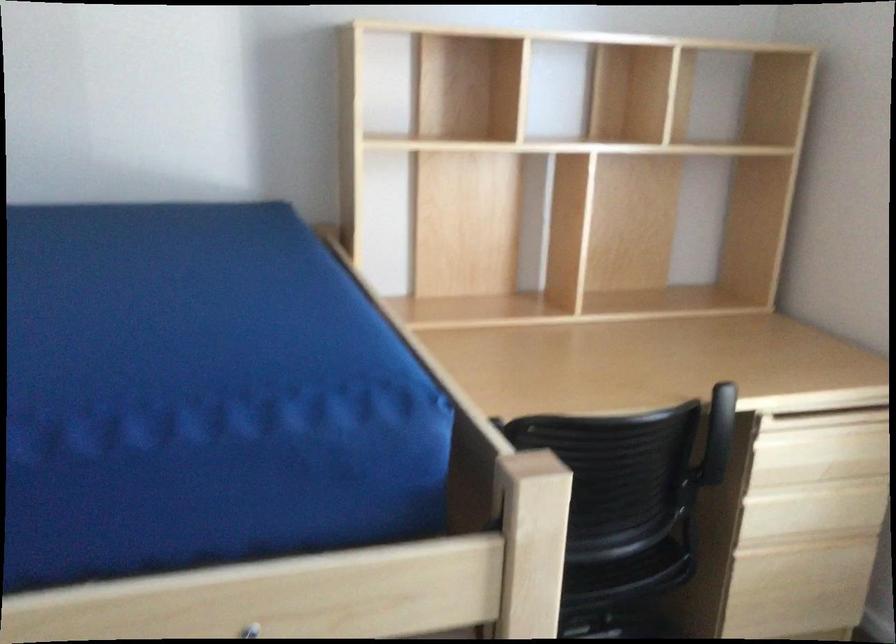
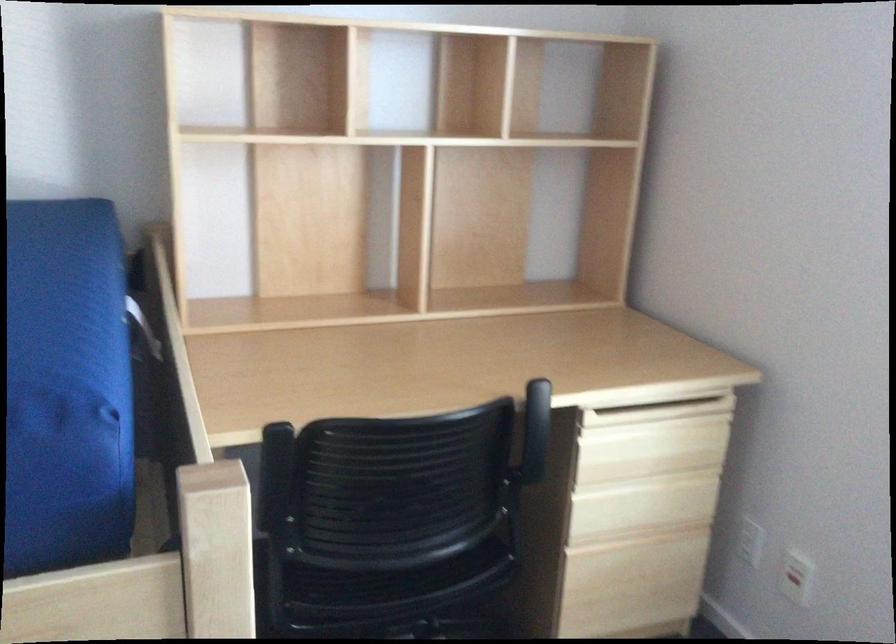
Question: I am providing you with two images of the same scene from different viewpoints. After the viewpoint changes to image2, which objects are now occluded?

Choices:
 (A) blue sofa sitting surface
 (B) red outlet switch
 (C) light wood drawer pull
 (D) none of these

Answer: (D)